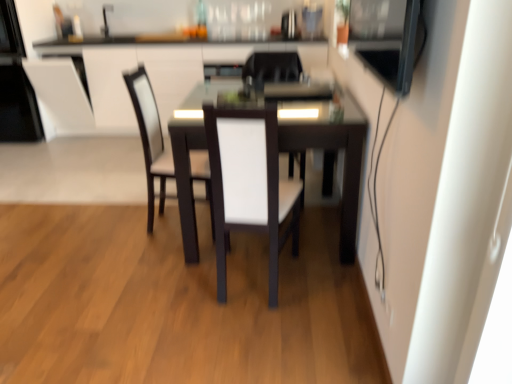
Locate an element on the screen. This screenshot has width=512, height=384. free spot below white fabric chair at center, marked as the first chair in a front-to-back arrangement (from a real-world perspective) is located at coordinates (251, 277).